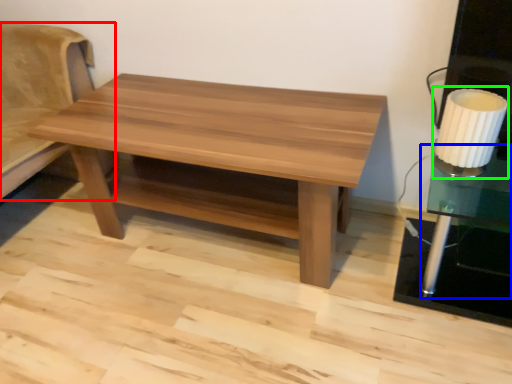
Question: Based on their relative distances, which object is farther from futon (highlighted by a red box)? Choose from side table (highlighted by a blue box) and table lamp (highlighted by a green box).

Choices:
 (A) side table
 (B) table lamp

Answer: (A)